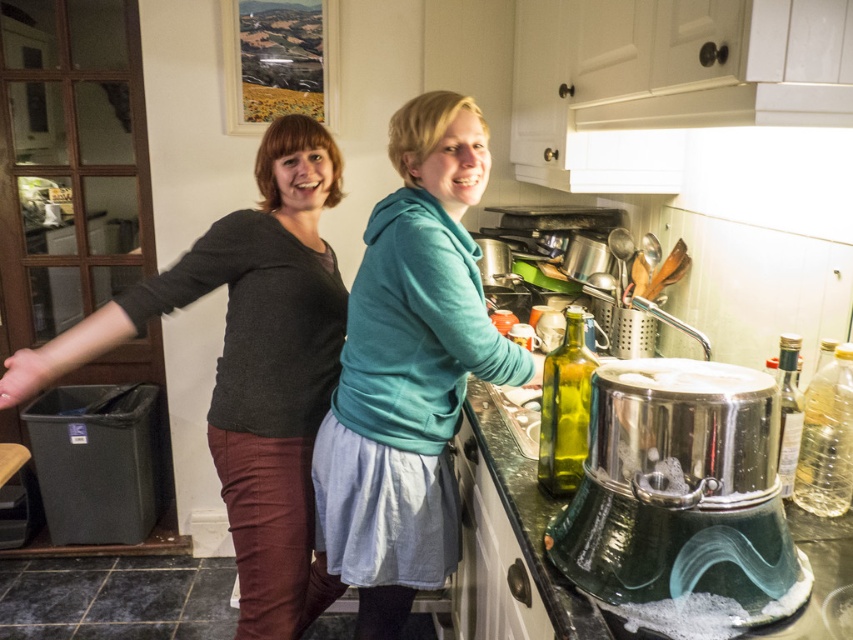
How far apart are teal hoodie at center and stainless steel pot at lower center?

19.45 inches

Does teal hoodie at center appear over stainless steel pot at lower center?

Yes, teal hoodie at center is above stainless steel pot at lower center.

This screenshot has height=640, width=853. In order to click on teal hoodie at center in this screenshot , I will do [409, 369].

This screenshot has height=640, width=853. I want to click on teal hoodie at center, so click(409, 369).

Who is shorter, matte black sweater at left or stainless steel pot at lower center?

Standing shorter between the two is stainless steel pot at lower center.

Measure the distance between matte black sweater at left and stainless steel pot at lower center.

matte black sweater at left is 35.49 inches from stainless steel pot at lower center.

Between point (285, 515) and point (674, 493), which one is positioned in front?

Positioned in front is point (674, 493).

Identify the location of matte black sweater at left. (250, 368).

Is teal hoodie at center to the left of matte black sweater at left from the viewer's perspective?

Incorrect, teal hoodie at center is not on the left side of matte black sweater at left.

Which of these two, teal hoodie at center or matte black sweater at left, stands shorter?

With less height is teal hoodie at center.

Which is behind, point (383, 612) or point (268, 218)?

The point (383, 612) is behind.

The image size is (853, 640). In order to click on teal hoodie at center in this screenshot , I will do `click(409, 369)`.